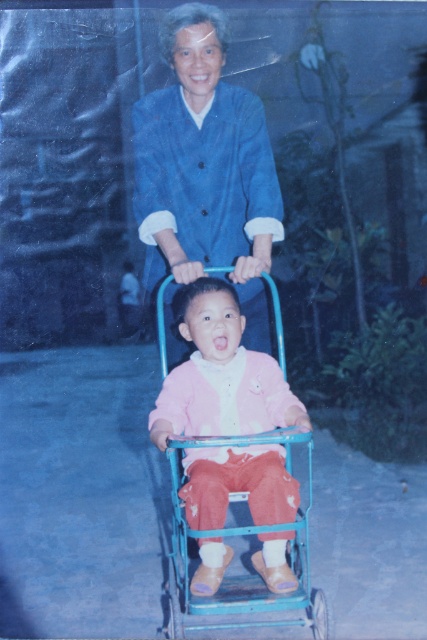
Question: Among these objects, which one is farthest from the camera?

Choices:
 (A) pink fleece jacket at center
 (B) blue cotton jacket at upper center

Answer: (B)

Question: Which point appears farthest from the camera in this image?

Choices:
 (A) (204, 500)
 (B) (187, 19)

Answer: (B)

Question: Where is blue cotton jacket at upper center located in relation to pink fleece jacket at center in the image?

Choices:
 (A) right
 (B) left

Answer: (B)

Question: Does blue cotton jacket at upper center appear over pink fleece jacket at center?

Choices:
 (A) no
 (B) yes

Answer: (B)

Question: Does blue cotton jacket at upper center have a larger size compared to pink fleece jacket at center?

Choices:
 (A) yes
 (B) no

Answer: (A)